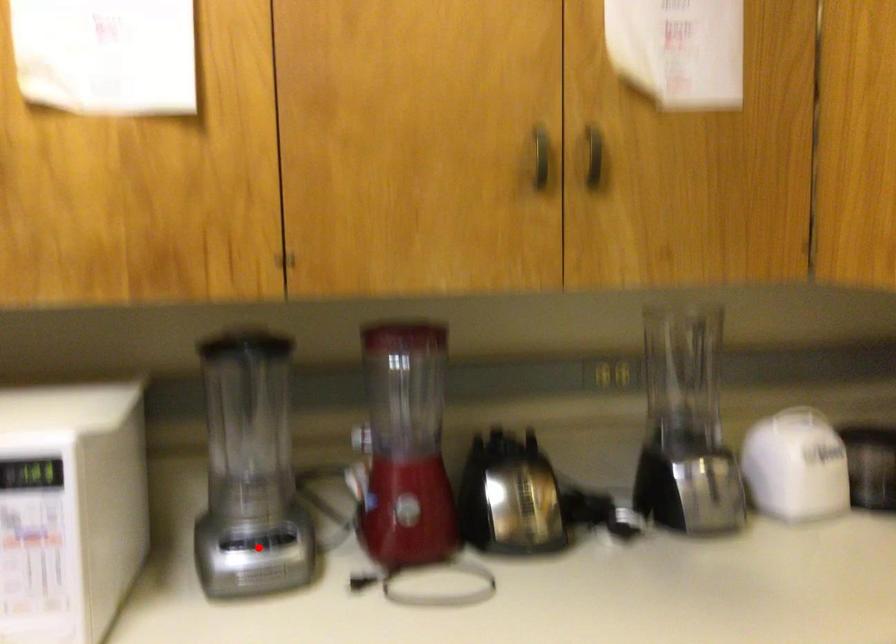
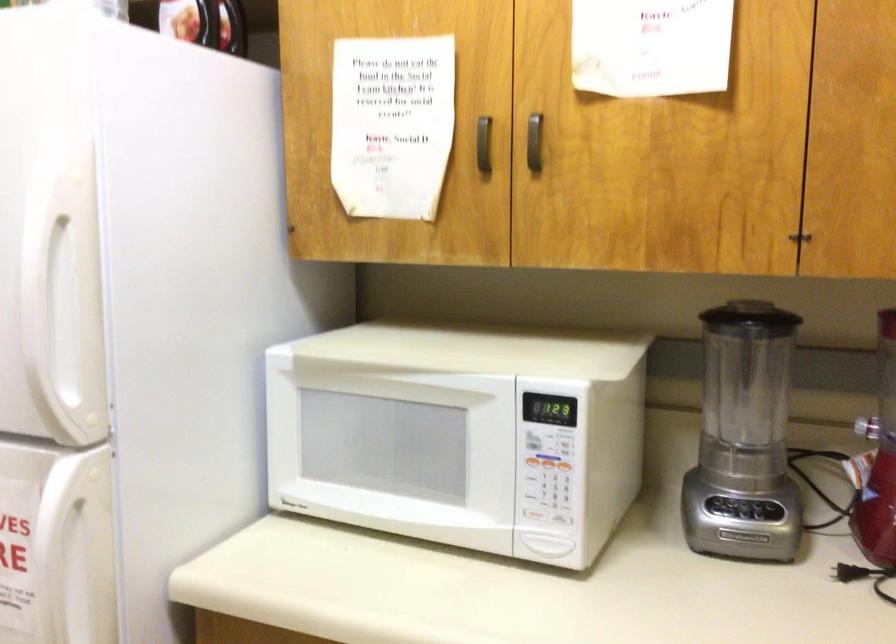
Where in the second image is the point corresponding to the highlighted location from the first image?

(744, 512)